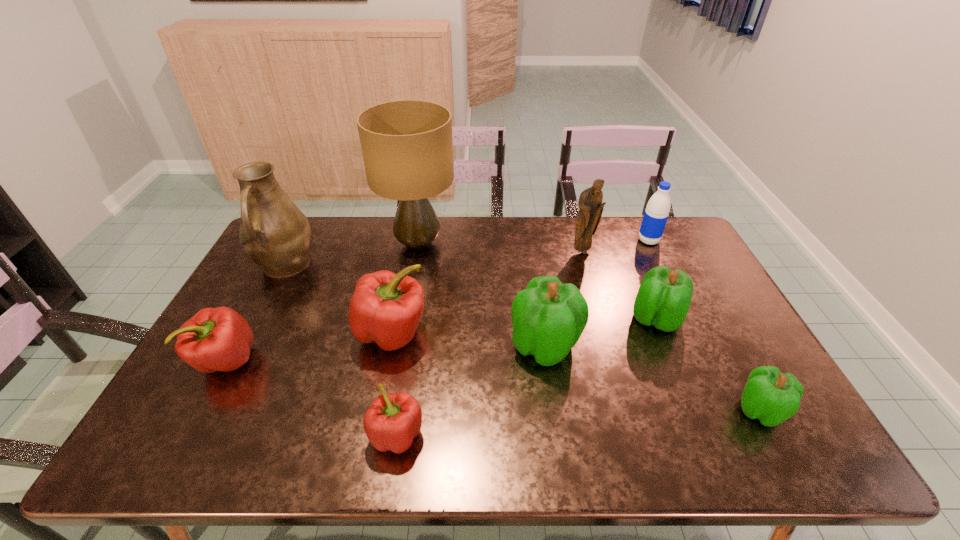
The height and width of the screenshot is (540, 960). I want to click on the second green bell pepper from left to right, so click(664, 296).

The height and width of the screenshot is (540, 960). In order to click on the leftmost pink bell pepper in this screenshot , I will do `click(215, 339)`.

Locate an element on the screen. The width and height of the screenshot is (960, 540). the second biggest pink bell pepper is located at coordinates (215, 339).

Locate an element on the screen. This screenshot has width=960, height=540. the rightmost bell pepper is located at coordinates (772, 397).

Find the location of a particular element. the nearest green bell pepper is located at coordinates (772, 397).

This screenshot has height=540, width=960. I want to click on the nearest pink bell pepper, so click(x=392, y=421).

Where is `vacant space located 0.230m on the right of the beige lampshade`? The image size is (960, 540). vacant space located 0.230m on the right of the beige lampshade is located at coordinates (521, 244).

Where is `vacant space situated 0.190m on the handle side of the ninth shortest object`? vacant space situated 0.190m on the handle side of the ninth shortest object is located at coordinates (249, 336).

Find the location of a particular element. The width and height of the screenshot is (960, 540). free space located 0.120m on the front-facing side of the seventh object from left to right is located at coordinates (589, 279).

The height and width of the screenshot is (540, 960). What are the coordinates of `free space located on the left of the blue water bottle` in the screenshot? It's located at (527, 241).